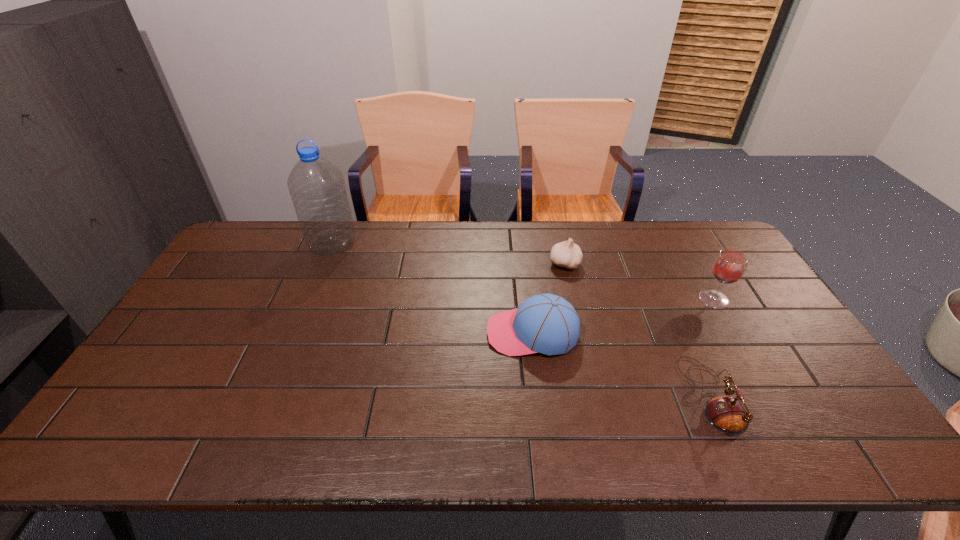
What are the coordinates of `free region located 0.260m on the front-facing side of the third tallest object` in the screenshot? It's located at (395, 333).

Where is `vacant space located 0.180m on the front-facing side of the third tallest object`? vacant space located 0.180m on the front-facing side of the third tallest object is located at coordinates (423, 333).

Where is `free location located on the front of the garlic`? This screenshot has height=540, width=960. free location located on the front of the garlic is located at coordinates (586, 356).

Locate an element on the screen. Image resolution: width=960 pixels, height=540 pixels. free space located 0.120m on the rotary dial of the fourth object from left to right is located at coordinates (634, 396).

You are a GUI agent. You are given a task and a screenshot of the screen. Output one action in this format:
    pyautogui.click(x=<x>, y=<y>)
    Task: Click on the vacant area located 0.070m on the rotary dial of the fourth object from left to right
    
    Given the screenshot: What is the action you would take?
    point(654,396)

What are the coordinates of `vacant space situated on the rotary dial of the fourth object from left to right` in the screenshot? It's located at (577, 396).

Where is `water jug that is at the far edge`? The height and width of the screenshot is (540, 960). water jug that is at the far edge is located at coordinates (317, 188).

I want to click on garlic at the far edge, so click(566, 254).

This screenshot has height=540, width=960. In order to click on object located in the near edge section of the desktop in this screenshot , I will do `click(727, 414)`.

Find the location of a particular element. object that is positioned at the right edge is located at coordinates coord(729,266).